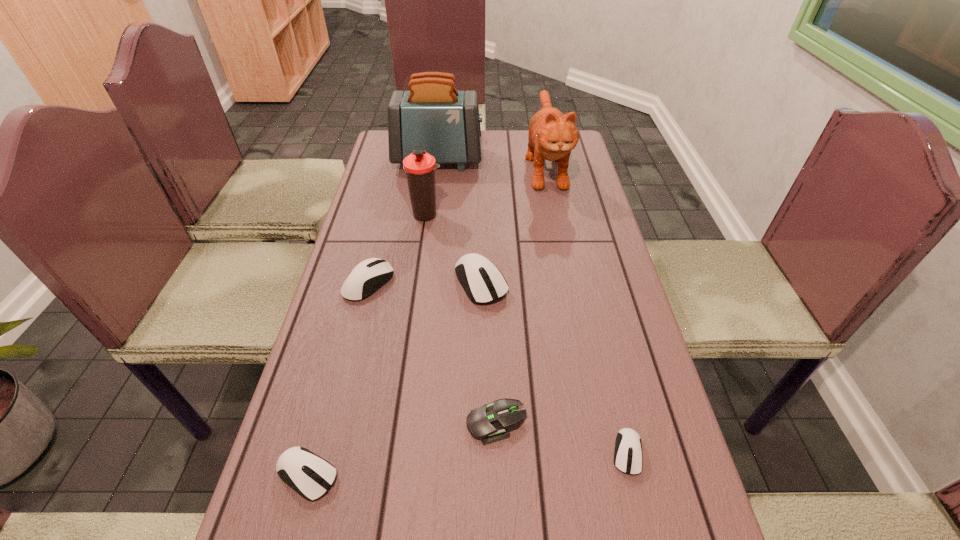
Find the location of `toaster`. toaster is located at coordinates (432, 113).

The height and width of the screenshot is (540, 960). I want to click on cat, so click(552, 135).

Find the location of `the sixth shortest object`. the sixth shortest object is located at coordinates (419, 166).

Where is `brown thermos bottle`? brown thermos bottle is located at coordinates (419, 166).

In order to click on the fourth tallest object in this screenshot , I will do `click(482, 281)`.

Identify the location of the tallest computer mouse. (482, 281).

This screenshot has width=960, height=540. In order to click on the fourth shortest object in this screenshot , I will do `click(369, 275)`.

What are the coordinates of `the second tallest computer mouse` in the screenshot? It's located at (369, 275).

Locate an element on the screen. the sixth tallest object is located at coordinates (308, 474).

Locate an element on the screen. the second smallest white mouse is located at coordinates (308, 474).